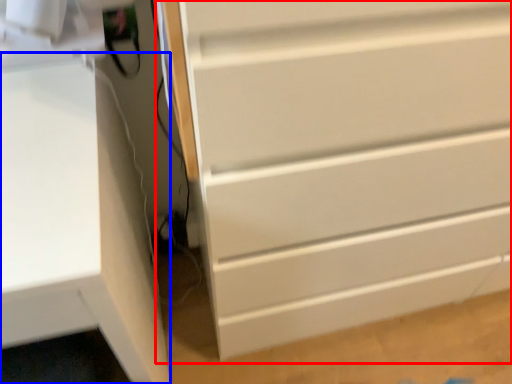
Question: Which object appears closest to the camera in this image, chest of drawers (highlighted by a red box) or computer desk (highlighted by a blue box)?

Choices:
 (A) chest of drawers
 (B) computer desk

Answer: (B)